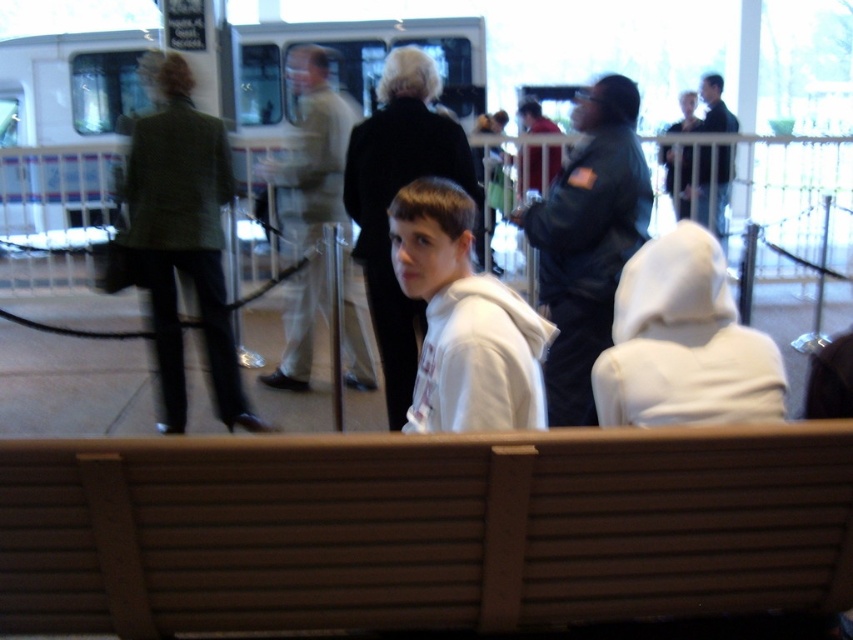
Question: Among these points, which one is farthest from the camera?

Choices:
 (A) (618, 259)
 (B) (531, 163)
 (C) (363, 566)

Answer: (B)

Question: Which point appears farthest from the camera in this image?

Choices:
 (A) (137, 176)
 (B) (527, 360)
 (C) (569, 196)
 (D) (531, 148)

Answer: (D)

Question: From the image, what is the correct spatial relationship of green textured blazer at left in relation to white matte hoodie at center?

Choices:
 (A) right
 (B) left

Answer: (B)

Question: Is green textured blazer at left below dark blue jacket at center?

Choices:
 (A) no
 (B) yes

Answer: (A)

Question: Can you confirm if dark blue jacket at center is positioned to the right of matte black jacket at center?

Choices:
 (A) no
 (B) yes

Answer: (A)

Question: Which object is positioned closest to the brown wood bench at center?

Choices:
 (A) dark blue jacket at center
 (B) matte black jacket at center

Answer: (A)